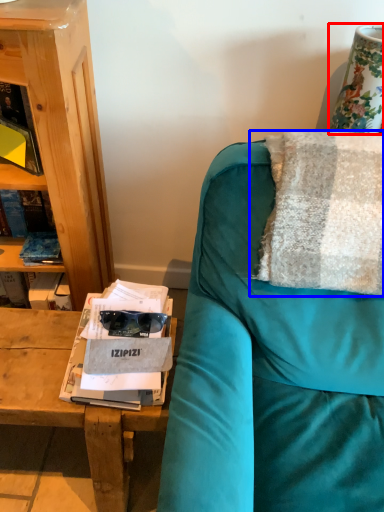
Question: Which object is further to the camera taking this photo, table lamp (highlighted by a red box) or pillow (highlighted by a blue box)?

Choices:
 (A) table lamp
 (B) pillow

Answer: (A)